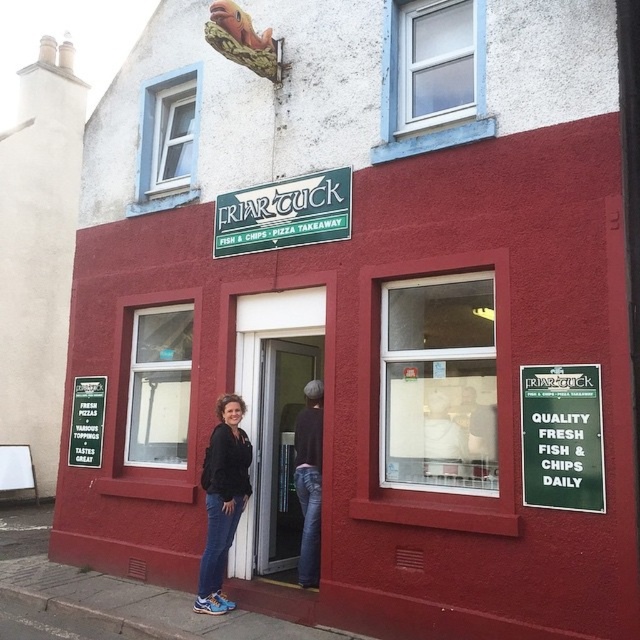
Is matte black jacket at center taller than green plastic signboard at center?

Yes, matte black jacket at center is taller than green plastic signboard at center.

Can you confirm if matte black jacket at center is positioned above green plastic signboard at center?

No.

Does point (250, 460) come farther from viewer compared to point (100, 424)?

No, it is not.

The height and width of the screenshot is (640, 640). Identify the location of matte black jacket at center. (221, 500).

Does green matte sign at upper center have a greater height compared to green plastic signboard at center?

No, green matte sign at upper center is not taller than green plastic signboard at center.

Between green matte sign at upper center and green plastic signboard at center, which one is positioned higher?

Positioned higher is green matte sign at upper center.

Locate an element on the screen. This screenshot has width=640, height=640. green matte sign at upper center is located at coordinates (284, 212).

The image size is (640, 640). In order to click on green matte sign at upper center in this screenshot , I will do `click(284, 212)`.

Is green matte signboard at center right smaller than green matte sign at upper center?

Indeed, green matte signboard at center right has a smaller size compared to green matte sign at upper center.

How distant is green matte signboard at center right from green matte sign at upper center?

A distance of 7.03 feet exists between green matte signboard at center right and green matte sign at upper center.

Locate an element on the screen. green matte signboard at center right is located at coordinates (561, 436).

Locate an element on the screen. green matte signboard at center right is located at coordinates (561, 436).